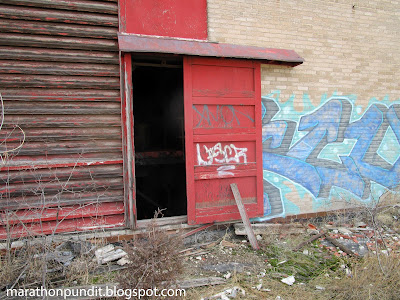
At what (x,y) coordinates should I click in order to perform the action: click on corner. Please return your answer as a coordinate pair (x, y). The height and width of the screenshot is (300, 400). Looking at the image, I should click on (13, 284), (388, 290), (390, 7), (13, 21).